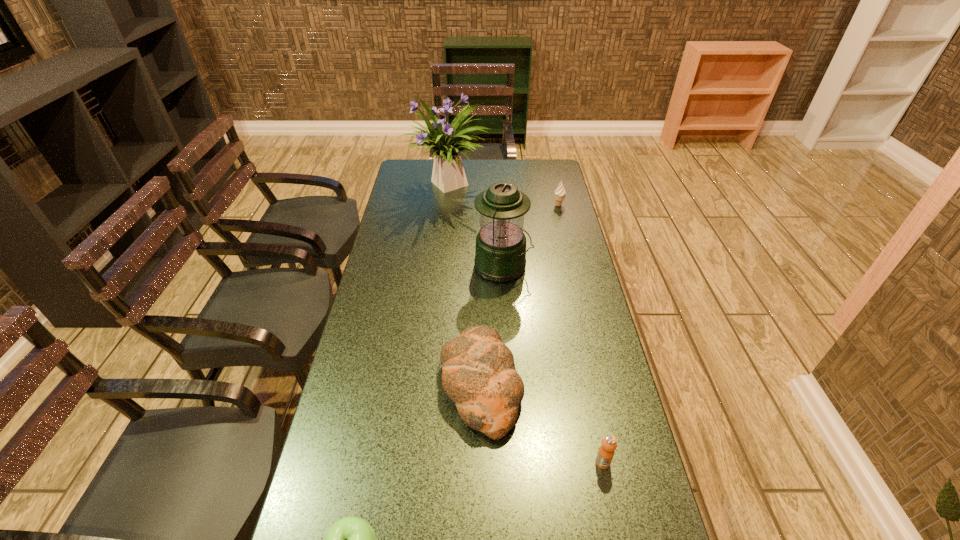
The image size is (960, 540). Identify the location of vacant region located 0.170m on the front-facing side of the icecream. pos(565,232).

At what (x,y) coordinates should I click in order to perform the action: click on free space located 0.120m on the front label of the orange juice. Please return your answer as a coordinate pair (x, y). Image resolution: width=960 pixels, height=540 pixels. Looking at the image, I should click on (615, 525).

Locate an element on the screen. object that is at the far edge is located at coordinates (448, 174).

Where is `object located in the left edge section of the desktop`? This screenshot has width=960, height=540. object located in the left edge section of the desktop is located at coordinates (448, 174).

Identify the location of icecream that is positioned at the right edge. The width and height of the screenshot is (960, 540). (560, 192).

I want to click on orange juice that is at the right edge, so click(x=605, y=454).

You are a GUI agent. You are given a task and a screenshot of the screen. Output one action in this format:
    pyautogui.click(x=<x>, y=<y>)
    Task: Click on the object positioned at the far left corner
    The width and height of the screenshot is (960, 540).
    Given the screenshot: What is the action you would take?
    pyautogui.click(x=448, y=174)

You are a GUI agent. You are given a task and a screenshot of the screen. Output one action in this format:
    pyautogui.click(x=<x>, y=<y>)
    Task: Click on the vacant region at the far edge
    The image size is (960, 540).
    Given the screenshot: What is the action you would take?
    pyautogui.click(x=502, y=168)

This screenshot has height=540, width=960. Find the location of `free space at the left edge of the desktop`. free space at the left edge of the desktop is located at coordinates (400, 200).

This screenshot has height=540, width=960. I want to click on free space at the right edge, so click(x=574, y=322).